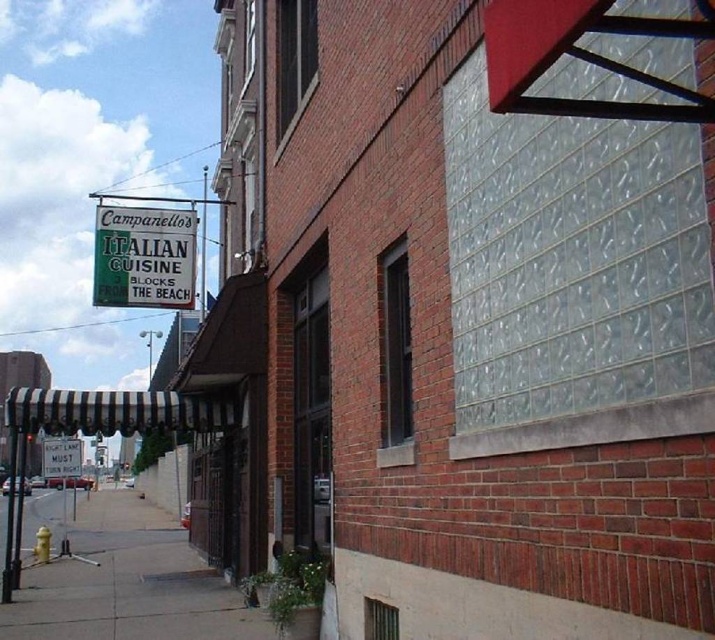
Looking at this image, you are a delivery person standing on the gray concrete sidewalk at lower left and need to find the white plastic sign at lower left. Which direction should you move to locate it?

The gray concrete sidewalk at lower left is positioned on the right side of white plastic sign at lower left, so you should move to your left to locate the white plastic sign at lower left.

You are a delivery person who needs to place a heavy box on the gray concrete sidewalk at lower left. However, there is a green paper sign at upper left above it. Can you safely place the box there without the sign getting damaged?

The gray concrete sidewalk at lower left is positioned under the green paper sign at upper left. Since the sign is above the sidewalk, placing the box there should be safe as the sign is elevated and won not be damaged by the box.